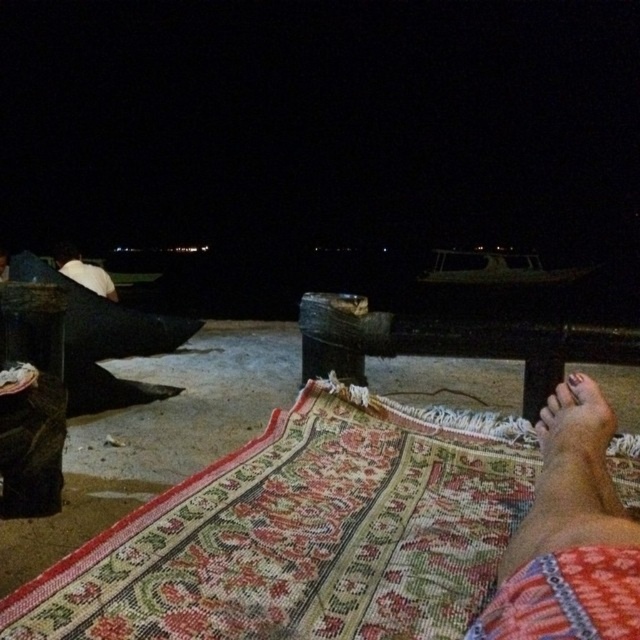
Does brown textured foot at lower right have a larger size compared to white matte umbrella at upper left?

No.

Which of these two, brown textured foot at lower right or white matte umbrella at upper left, stands shorter?

Standing shorter between the two is brown textured foot at lower right.

Who is more distant from viewer, (561, 406) or (88, 276)?

Positioned behind is point (88, 276).

Find the location of a particular element. The image size is (640, 640). brown textured foot at lower right is located at coordinates (576, 452).